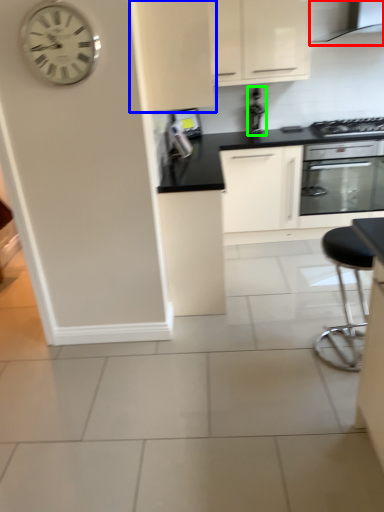
Question: Which is nearer to the exhaust hood (highlighted by a red box)? cabinetry (highlighted by a blue box) or appliance (highlighted by a green box).

Choices:
 (A) cabinetry
 (B) appliance

Answer: (B)